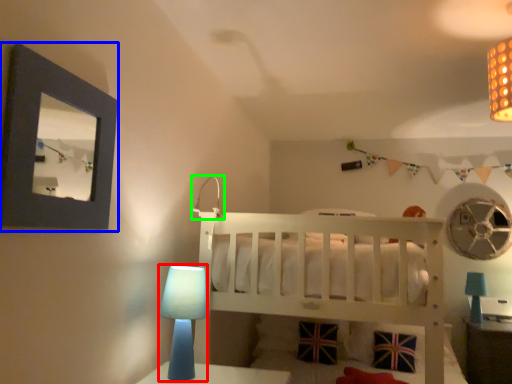
Question: Based on their relative distances, which object is farther from table lamp (highlighted by a red box)? Choose from picture frame (highlighted by a blue box) and lamp (highlighted by a green box).

Choices:
 (A) picture frame
 (B) lamp

Answer: (A)